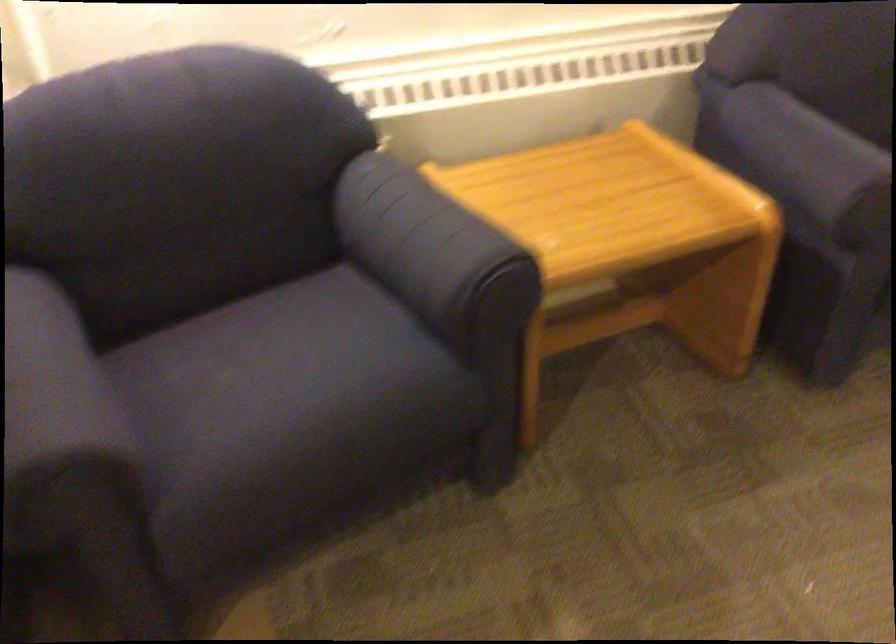
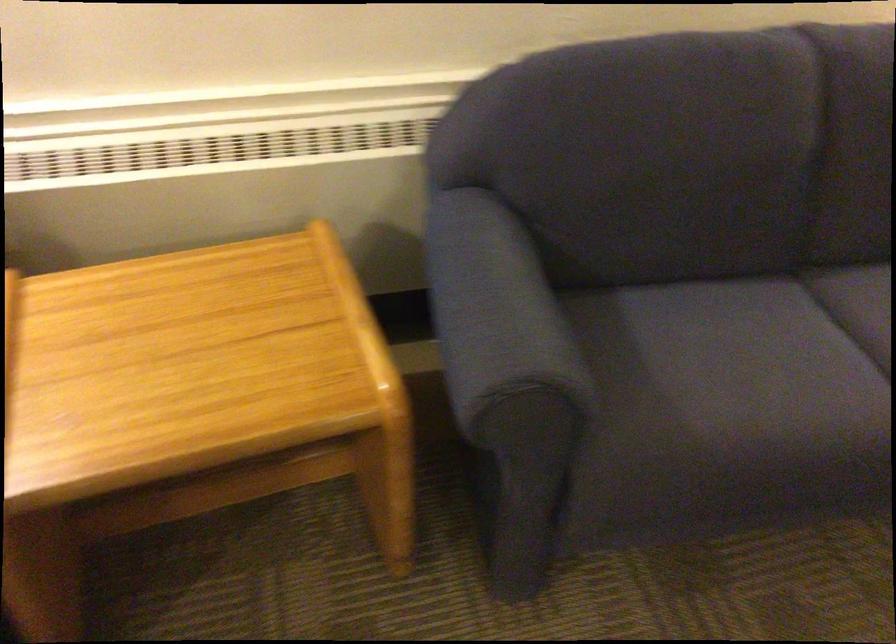
Which direction would the cameraman need to move to produce the second image?

The cameraman walked toward right, forward.